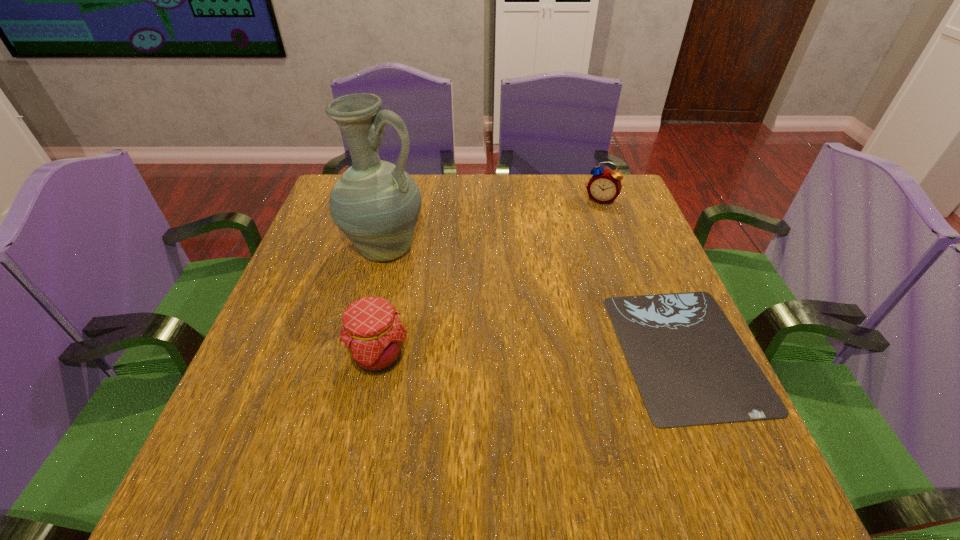
Identify the location of jam. The height and width of the screenshot is (540, 960). (374, 337).

At what (x,y) coordinates should I click in order to perform the action: click on mousepad. Please return your answer as a coordinate pair (x, y). Image resolution: width=960 pixels, height=540 pixels. Looking at the image, I should click on (691, 368).

Where is `pitcher`? The image size is (960, 540). pitcher is located at coordinates (375, 203).

This screenshot has height=540, width=960. Identify the location of the third nearest object. (375, 203).

At what (x,y) coordinates should I click in order to perform the action: click on alarm clock. Please return your answer as a coordinate pair (x, y). Looking at the image, I should click on (604, 186).

You are a GUI agent. You are given a task and a screenshot of the screen. Output one action in this format:
    pyautogui.click(x=<x>, y=<y>)
    Task: Click on the blank space located 0.060m on the back of the jam
    
    Given the screenshot: What is the action you would take?
    pyautogui.click(x=388, y=312)

The height and width of the screenshot is (540, 960). What are the coordinates of `vacant space located on the back of the mousepad` in the screenshot? It's located at (x=630, y=220).

Where is `vacant space situated on the handle side of the pitcher`? vacant space situated on the handle side of the pitcher is located at coordinates (434, 277).

This screenshot has height=540, width=960. I want to click on free space located on the handle side of the pitcher, so click(461, 291).

The height and width of the screenshot is (540, 960). Identify the location of blank space located 0.130m on the handle side of the pitcher. (457, 289).